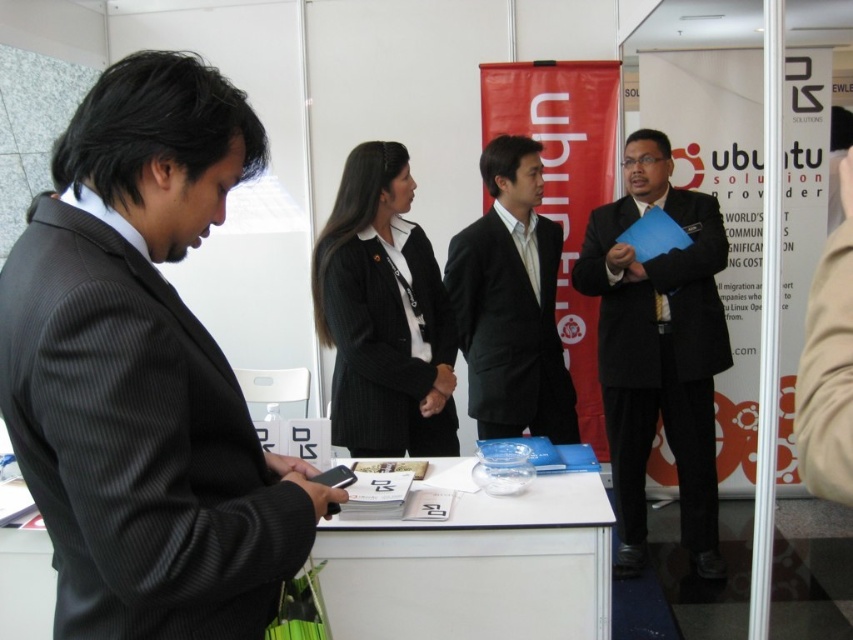
Question: Among these objects, which one is farthest from the camera?

Choices:
 (A) black pinstripe suit at left
 (B) black suit at center

Answer: (B)

Question: Where is matte black suit at center located in relation to black suit at center in the image?

Choices:
 (A) below
 (B) above

Answer: (A)

Question: Which of the following is the closest to the observer?

Choices:
 (A) black pinstripe suit at left
 (B) black ribbed blazer at center

Answer: (A)

Question: Is matte black suit at center positioned at the back of black ribbed blazer at center?

Choices:
 (A) no
 (B) yes

Answer: (B)

Question: Is matte black suit at center further to the viewer compared to black suit at center?

Choices:
 (A) yes
 (B) no

Answer: (A)

Question: Among these objects, which one is farthest from the camera?

Choices:
 (A) matte black suit at center
 (B) black pinstripe suit at left

Answer: (A)